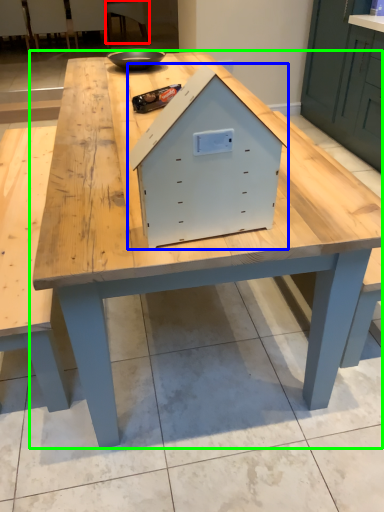
Question: Estimate the real-world distances between objects in this image. Which object is farther from chair (highlighted by a red box), crate (highlighted by a blue box) or table (highlighted by a green box)?

Choices:
 (A) crate
 (B) table

Answer: (A)